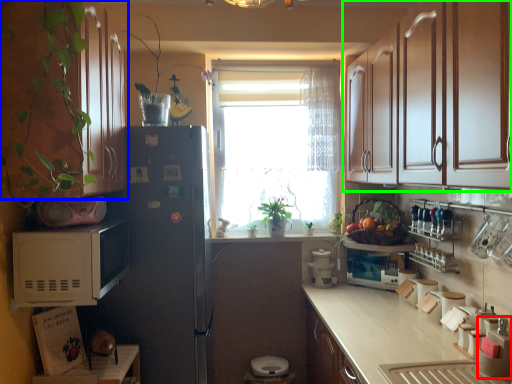
Question: Considering the real-world distances, which object is farthest from appliance (highlighted by a red box)? cabinetry (highlighted by a blue box) or cabinetry (highlighted by a green box)?

Choices:
 (A) cabinetry
 (B) cabinetry

Answer: (A)